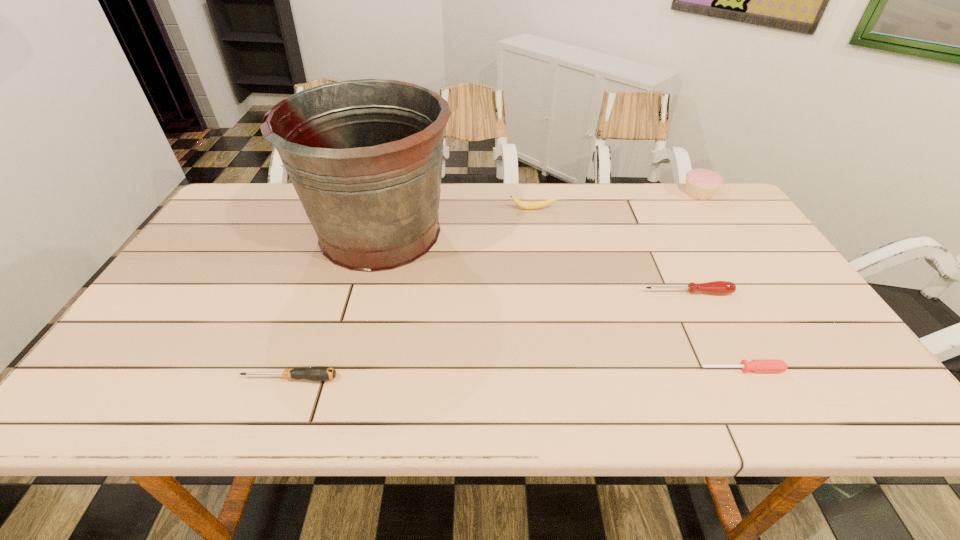
Where is `the tallest object`? The height and width of the screenshot is (540, 960). the tallest object is located at coordinates (365, 156).

The width and height of the screenshot is (960, 540). What are the coordinates of `the rightmost object` in the screenshot? It's located at (701, 184).

You are a GUI agent. You are given a task and a screenshot of the screen. Output one action in this format:
    pyautogui.click(x=<x>, y=<y>)
    Task: Click on the fifth shortest object
    
    Given the screenshot: What is the action you would take?
    pyautogui.click(x=701, y=184)

I want to click on the fourth object from right to left, so click(x=522, y=204).

This screenshot has height=540, width=960. Find the location of `banana`. banana is located at coordinates (522, 204).

Where is `the fourth farthest object`? The height and width of the screenshot is (540, 960). the fourth farthest object is located at coordinates (716, 287).

The image size is (960, 540). In order to click on the leftmost screwdriver in this screenshot , I will do `click(317, 373)`.

In order to click on the shortest screwdriver in this screenshot , I will do `click(758, 366)`.

You are a GUI agent. You are given a task and a screenshot of the screen. Output one action in this format:
    pyautogui.click(x=<x>, y=<y>)
    Task: Click on the free space located on the left of the tallest object
    
    Given the screenshot: What is the action you would take?
    pyautogui.click(x=264, y=232)

Where is `free space located 0.350m on the front of the second tallest object`? This screenshot has height=540, width=960. free space located 0.350m on the front of the second tallest object is located at coordinates (755, 276).